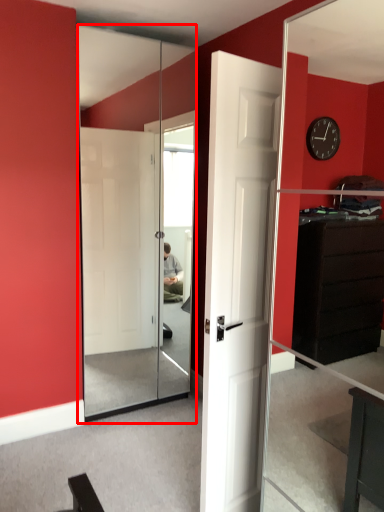
Question: From the image's perspective, considering the relative positions of screen door (annotated by the red box) and door in the image provided, where is screen door (annotated by the red box) located with respect to the staircase?

Choices:
 (A) above
 (B) below

Answer: (A)